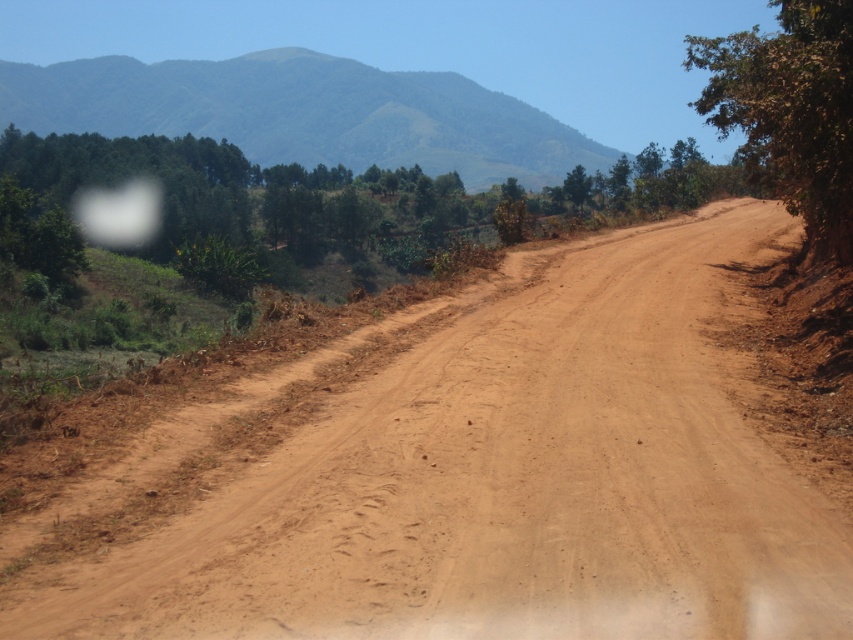
You are standing at the starting point of the dirt road and want to reach the end of the road. According to the coordinates provided, where exactly is the brown dirt road at center located?

The brown dirt road at center is located at the coordinates point (508, 484).

Looking at this image, you are a hiker planning to cross the dirt road. You see the green textured hill at upper center and the brown rough tree at right. Which object would you need to walk around if you want to avoid the tire tracks on the road?

The green textured hill at upper center is wider than the brown rough tree at right, so you would need to walk around the green textured hill at upper center to avoid the tire tracks on the road.

From the picture: You are driving a car and see the brown dirt road at center and the green textured hill at upper center. Which object is located to the right of the other?

The brown dirt road at center is positioned on the right side of the green textured hill at upper center.